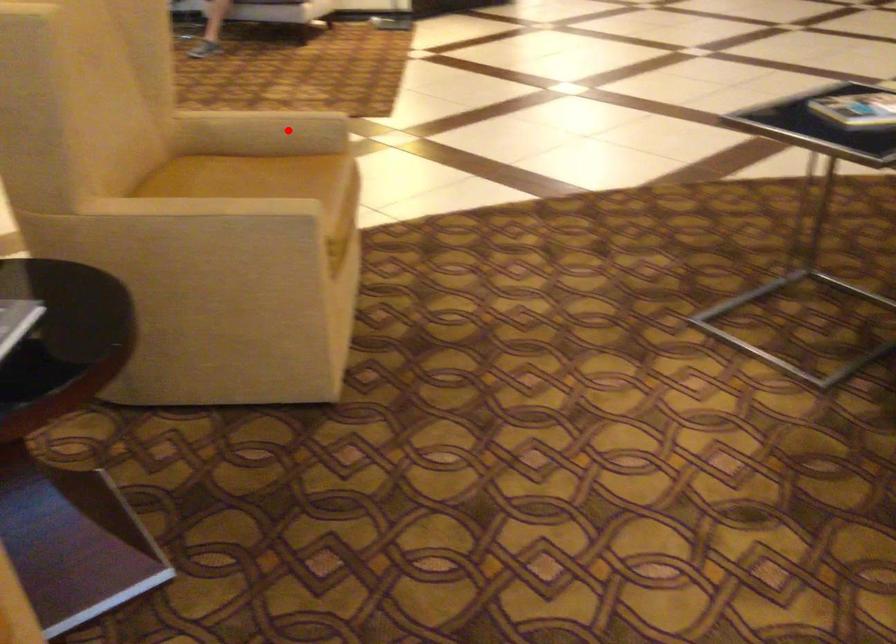
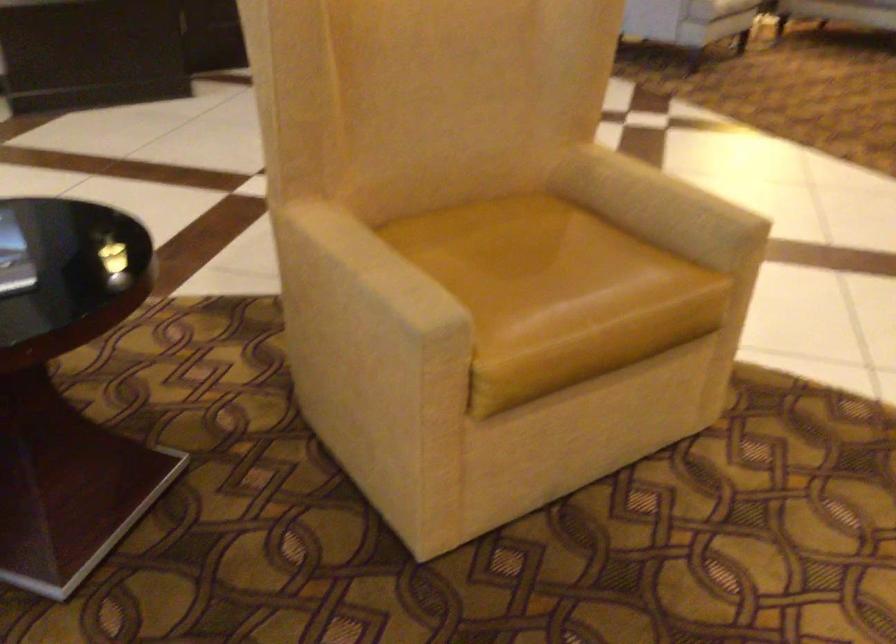
Question: I am providing you with two images of the same scene from different viewpoints. A red point is shown in image1. For the corresponding object point in image2, is it positioned nearer or farther from the camera?

Choices:
 (A) Nearer
 (B) Farther

Answer: (A)